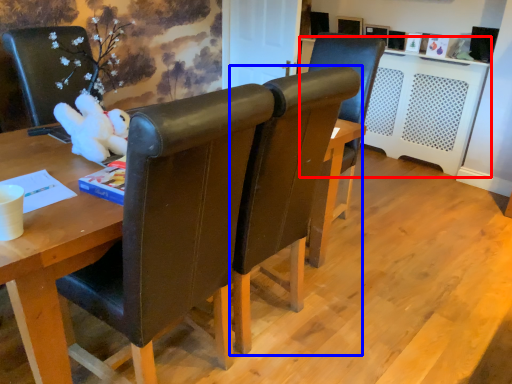
Question: Which of the following is the farthest to the observer, computer desk (highlighted by a red box) or chair (highlighted by a blue box)?

Choices:
 (A) computer desk
 (B) chair

Answer: (A)